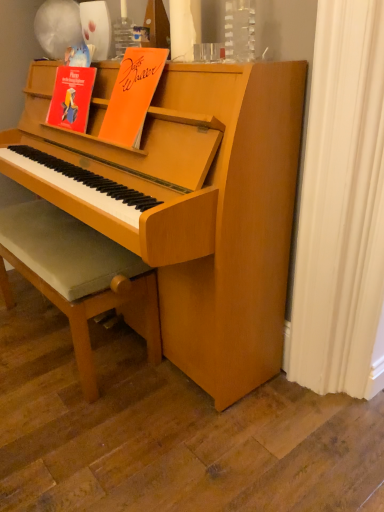
The image size is (384, 512). What are the coordinates of `orange matte paper at upper center` in the screenshot? It's located at (132, 96).

What do you see at coordinates (132, 96) in the screenshot? This screenshot has height=512, width=384. I see `orange matte paper at upper center` at bounding box center [132, 96].

What do you see at coordinates (76, 275) in the screenshot? Image resolution: width=384 pixels, height=512 pixels. I see `light brown wooden footrest at lower left` at bounding box center [76, 275].

What is the approximate height of light brown wooden footrest at lower left?

It is 20.54 inches.

Where is `light brown wooden footrest at lower left`? This screenshot has height=512, width=384. light brown wooden footrest at lower left is located at coordinates (76, 275).

This screenshot has width=384, height=512. What are the coordinates of `orange matte paper at upper center` in the screenshot? It's located at (132, 96).

Visually, is orange matte paper at upper center positioned to the left or to the right of light brown wooden footrest at lower left?

Based on their positions, orange matte paper at upper center is located to the right of light brown wooden footrest at lower left.

Is orange matte paper at upper center closer to the viewer compared to light brown wooden footrest at lower left?

Yes, the depth of orange matte paper at upper center is less than that of light brown wooden footrest at lower left.

Is point (105, 130) positioned behind point (98, 250)?

No, it is not.

From the image's perspective, is orange matte paper at upper center below light brown wooden footrest at lower left?

Actually, orange matte paper at upper center appears above light brown wooden footrest at lower left in the image.

From a real-world perspective, which is physically below, orange matte paper at upper center or light brown wooden footrest at lower left?

light brown wooden footrest at lower left.

Which of these two, orange matte paper at upper center or light brown wooden footrest at lower left, is thinner?

Thinner between the two is orange matte paper at upper center.

Which of these two, orange matte paper at upper center or light brown wooden footrest at lower left, stands taller?

Standing taller between the two is light brown wooden footrest at lower left.

Is orange matte paper at upper center bigger than light brown wooden footrest at lower left?

Incorrect, orange matte paper at upper center is not larger than light brown wooden footrest at lower left.

Does orange matte paper at upper center contain light brown wooden footrest at lower left?

No, light brown wooden footrest at lower left is not inside orange matte paper at upper center.

Is orange matte paper at upper center touching light brown wooden footrest at lower left?

No.

Is orange matte paper at upper center positioned with its back to light brown wooden footrest at lower left?

orange matte paper at upper center does not have its back to light brown wooden footrest at lower left.

What's the angular difference between orange matte paper at upper center and light brown wooden footrest at lower left's facing directions?

The angular difference between orange matte paper at upper center and light brown wooden footrest at lower left is 1.3 degrees.

You are a GUI agent. You are given a task and a screenshot of the screen. Output one action in this format:
    pyautogui.click(x=<x>, y=<y>)
    Task: Click on the paperback book in front of the light brown wooden footrest at lower left
    This screenshot has width=384, height=512.
    Given the screenshot: What is the action you would take?
    click(x=132, y=96)

Which object is positioned more to the left, light brown wooden footrest at lower left or orange matte paper at upper center?

light brown wooden footrest at lower left.

Is the position of light brown wooden footrest at lower left more distant than that of orange matte paper at upper center?

Yes, light brown wooden footrest at lower left is further from the camera.

Is point (105, 304) farther from camera compared to point (138, 53)?

Yes, it is.

From the image's perspective, is light brown wooden footrest at lower left above or below orange matte paper at upper center?

light brown wooden footrest at lower left is below orange matte paper at upper center.

From a real-world perspective, between light brown wooden footrest at lower left and orange matte paper at upper center, who is vertically lower?

From a 3D spatial view, light brown wooden footrest at lower left is below.

Between light brown wooden footrest at lower left and orange matte paper at upper center, which one has smaller width?

Thinner between the two is orange matte paper at upper center.

In terms of height, does light brown wooden footrest at lower left look taller or shorter compared to orange matte paper at upper center?

Clearly, light brown wooden footrest at lower left is taller compared to orange matte paper at upper center.

Looking at the image, does light brown wooden footrest at lower left seem bigger or smaller compared to orange matte paper at upper center?

In the image, light brown wooden footrest at lower left appears to be larger than orange matte paper at upper center.

Is light brown wooden footrest at lower left spatially inside orange matte paper at upper center, or outside of it?

light brown wooden footrest at lower left is not inside orange matte paper at upper center, it's outside.

Is light brown wooden footrest at lower left not close to orange matte paper at upper center?

light brown wooden footrest at lower left is actually quite close to orange matte paper at upper center.

Is light brown wooden footrest at lower left turned away from orange matte paper at upper center?

No, light brown wooden footrest at lower left's orientation is not away from orange matte paper at upper center.

Can you tell me how much light brown wooden footrest at lower left and orange matte paper at upper center differ in facing direction?

They differ by 1.3 degrees in their facing directions.

You are a GUI agent. You are given a task and a screenshot of the screen. Output one action in this format:
    pyautogui.click(x=<x>, y=<y>)
    Task: Click on the paperback book in front of the light brown wooden footrest at lower left
    The image size is (384, 512).
    Given the screenshot: What is the action you would take?
    coord(132,96)

This screenshot has height=512, width=384. What are the coordinates of `the footrest that appears below the orange matte paper at upper center (from a real-world perspective)` in the screenshot? It's located at (76, 275).

I want to click on footrest on the left side of orange matte paper at upper center, so click(76, 275).